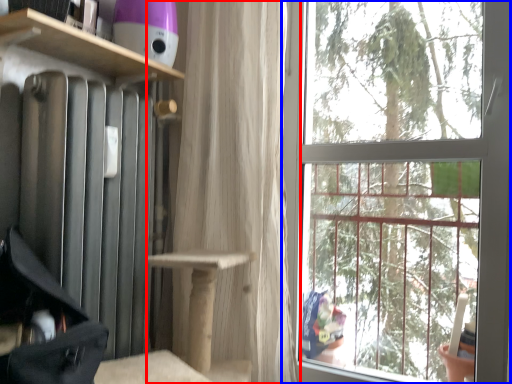
Question: Which of the following is the closest to the observer, curtain (highlighted by a red box) or window (highlighted by a blue box)?

Choices:
 (A) curtain
 (B) window

Answer: (B)